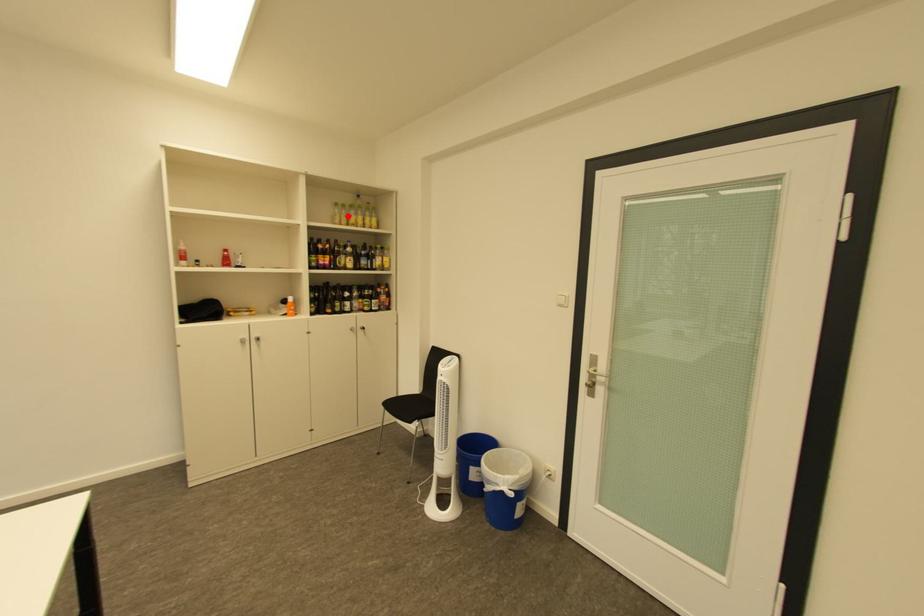
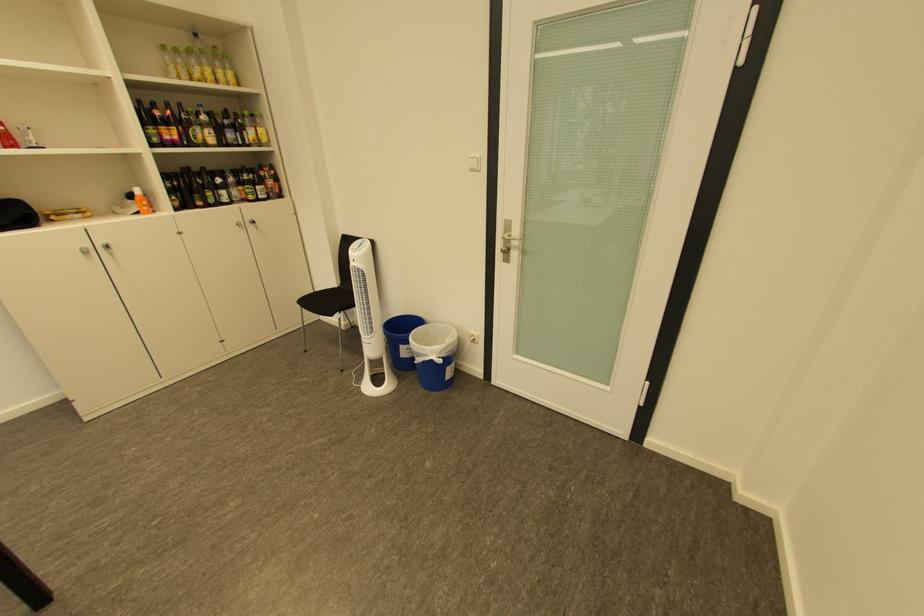
Locate, in the second image, the point that corresponds to the highlighted location in the first image.

(180, 66)